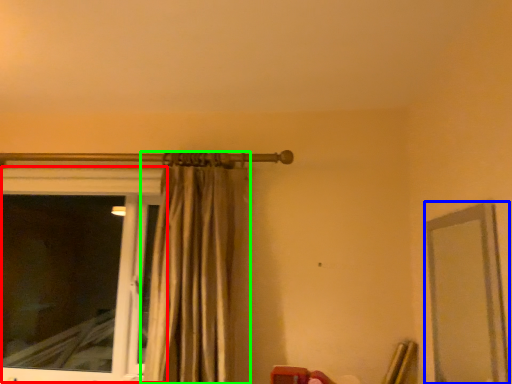
Question: Which object is the farthest from window (highlighted by a red box)? Choose among these: mirror (highlighted by a blue box) or curtain (highlighted by a green box).

Choices:
 (A) mirror
 (B) curtain

Answer: (A)